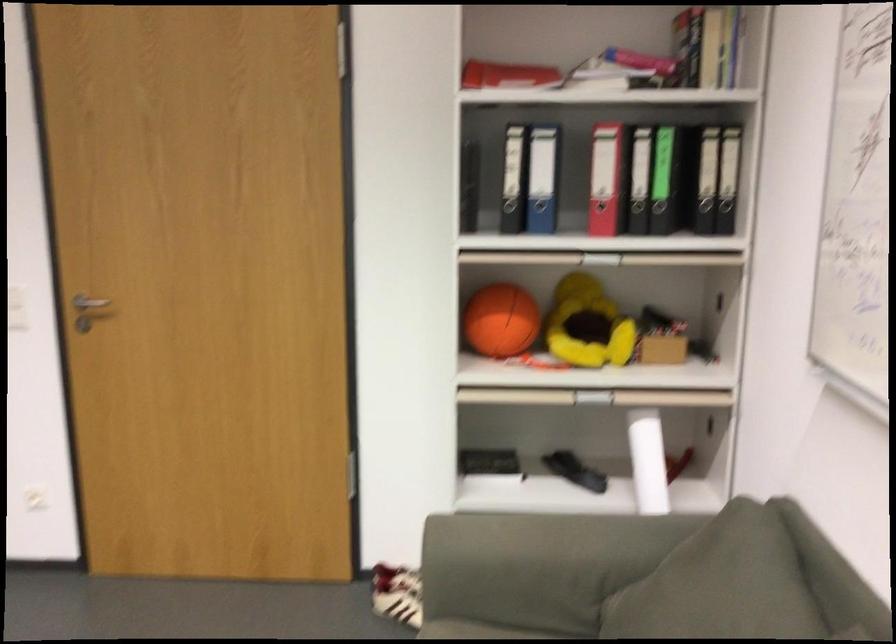
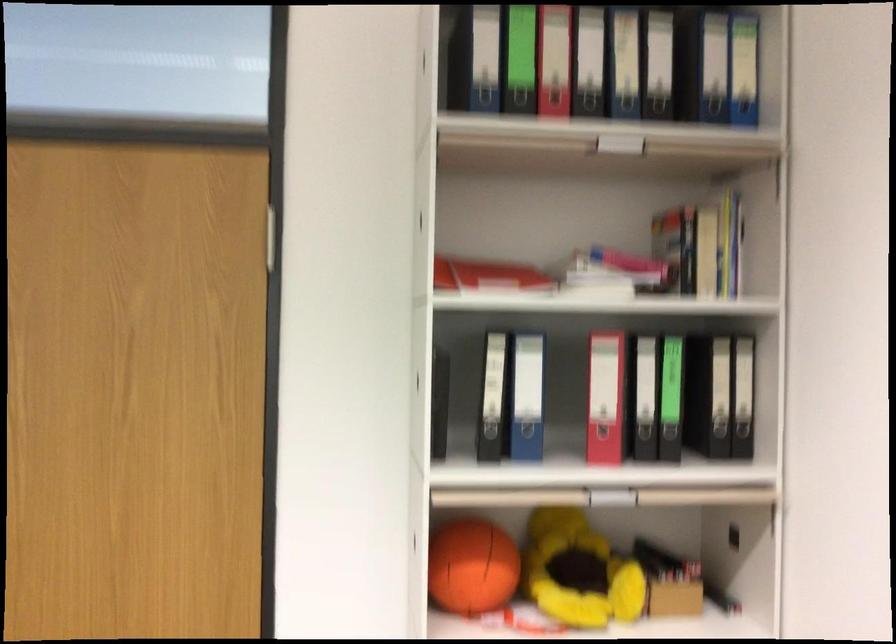
Question: The images are taken continuously from a first-person perspective. In which direction is your viewpoint rotating?

Choices:
 (A) Left
 (B) Right
 (C) Up
 (D) Down

Answer: (C)